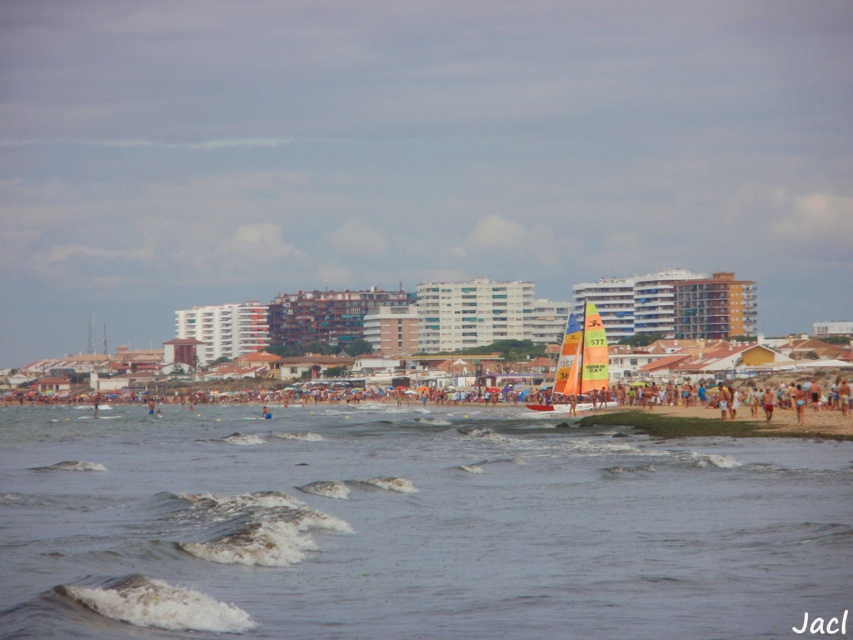
You are a photographer trying to capture the multicolored sailboat at center and the blue fabric shorts at lower right in the same frame. Based on their sizes, which object should you focus on first to ensure both are clearly visible in your photo?

The multicolored sailboat at center is larger than the blue fabric shorts at lower right, so you should focus on the multicolored sailboat at center first to ensure both are clearly visible in your photo.

Consider the image. You are standing on the beach and see two points marked on the sand. The first point is at coordinates point (553,412) and the second is at point (793,396). Which point is closer to you?

Point (553,412) is further to the viewer than point (793,396), so the second point is closer to you.

You are a beachgoer standing at the waterline. You see the orange fabric sailboat at center and the blue fabric shorts at lower right. Which object is closer to your right side?

The blue fabric shorts at lower right are closer to your right side because the orange fabric sailboat at center is to the left of them.